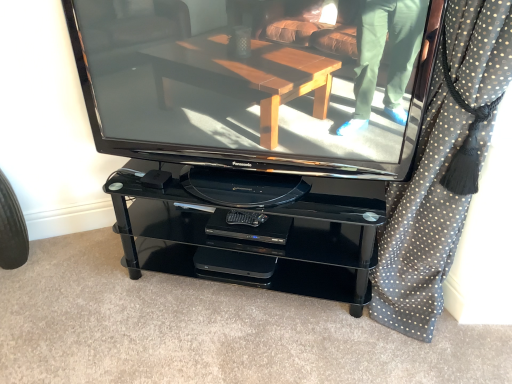
Question: From their relative heights in the image, would you say matte black television at center is taller or shorter than black rubber tire at lower left?

Choices:
 (A) tall
 (B) short

Answer: (A)

Question: Does point (288, 145) appear closer or farther from the camera than point (11, 246)?

Choices:
 (A) closer
 (B) farther

Answer: (A)

Question: Based on their relative distances, which object is farther from the black rubber tire at lower left?

Choices:
 (A) matte black television at center
 (B) black dotted fabric at right

Answer: (B)

Question: Which object is positioned closest to the matte black television at center?

Choices:
 (A) black dotted fabric at right
 (B) black rubber tire at lower left

Answer: (A)